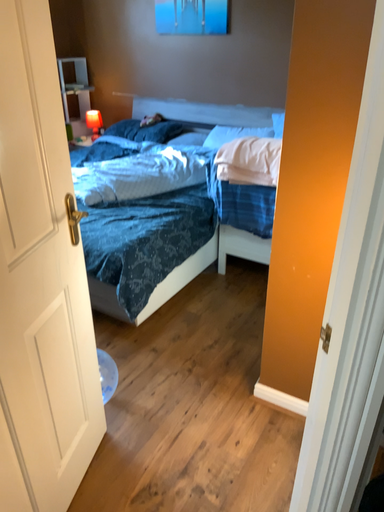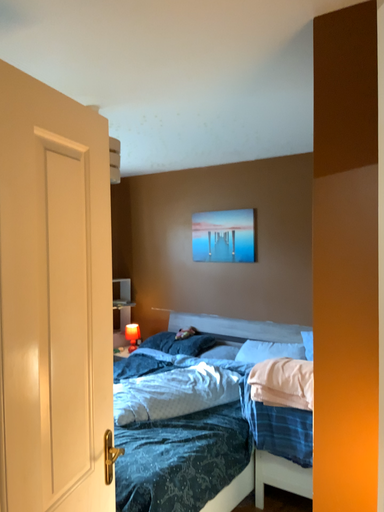
Question: Which way did the camera rotate in the video?

Choices:
 (A) rotated upward
 (B) rotated downward

Answer: (A)